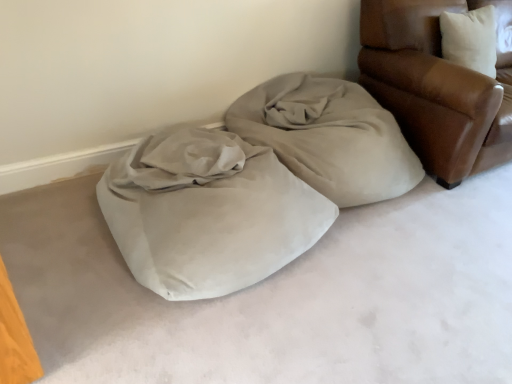
Question: Is leather armchair at upper right far away from suede-like beige bean bag at center?

Choices:
 (A) yes
 (B) no

Answer: (B)

Question: Is the depth of leather armchair at upper right less than that of suede-like beige bean bag at center?

Choices:
 (A) yes
 (B) no

Answer: (B)

Question: Are leather armchair at upper right and suede-like beige bean bag at center beside each other?

Choices:
 (A) no
 (B) yes

Answer: (A)

Question: From a real-world perspective, is leather armchair at upper right located higher than suede-like beige bean bag at center?

Choices:
 (A) yes
 (B) no

Answer: (A)

Question: From a real-world perspective, is leather armchair at upper right below suede-like beige bean bag at center?

Choices:
 (A) no
 (B) yes

Answer: (A)

Question: Would you say leather armchair at upper right contains suede-like beige bean bag at center?

Choices:
 (A) yes
 (B) no

Answer: (B)

Question: Is leather armchair at upper right to the right of beige fabric at center from the viewer's perspective?

Choices:
 (A) yes
 (B) no

Answer: (A)

Question: From the image's perspective, is leather armchair at upper right over beige fabric at center?

Choices:
 (A) yes
 (B) no

Answer: (A)

Question: Does leather armchair at upper right lie in front of beige fabric at center?

Choices:
 (A) no
 (B) yes

Answer: (B)

Question: Can you see leather armchair at upper right touching beige fabric at center?

Choices:
 (A) yes
 (B) no

Answer: (B)

Question: From the image's perspective, is leather armchair at upper right below beige fabric at center?

Choices:
 (A) yes
 (B) no

Answer: (B)

Question: Is beige fabric at center surrounded by leather armchair at upper right?

Choices:
 (A) no
 (B) yes

Answer: (A)

Question: Is the position of suede-like beige bean bag at center less distant than that of leather armchair at upper right?

Choices:
 (A) no
 (B) yes

Answer: (B)